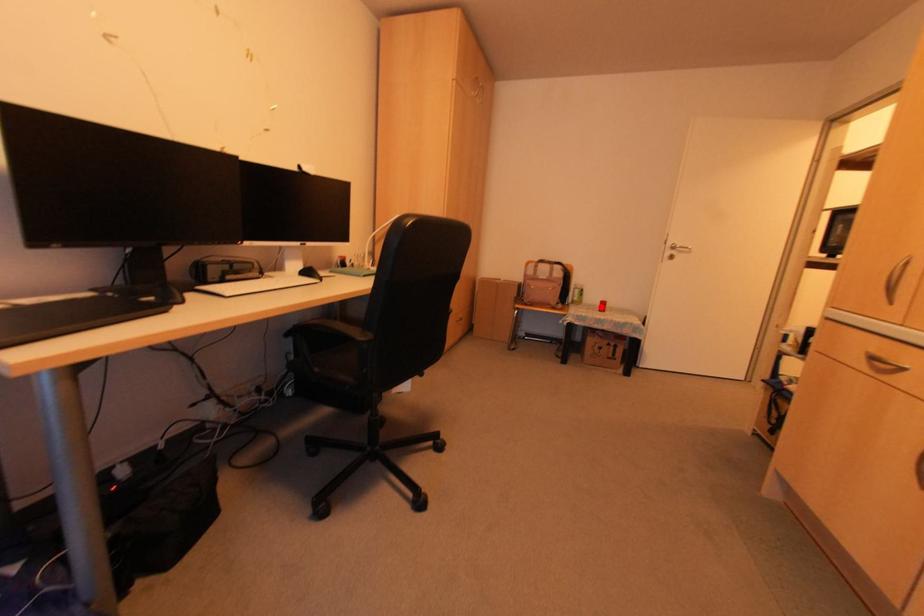
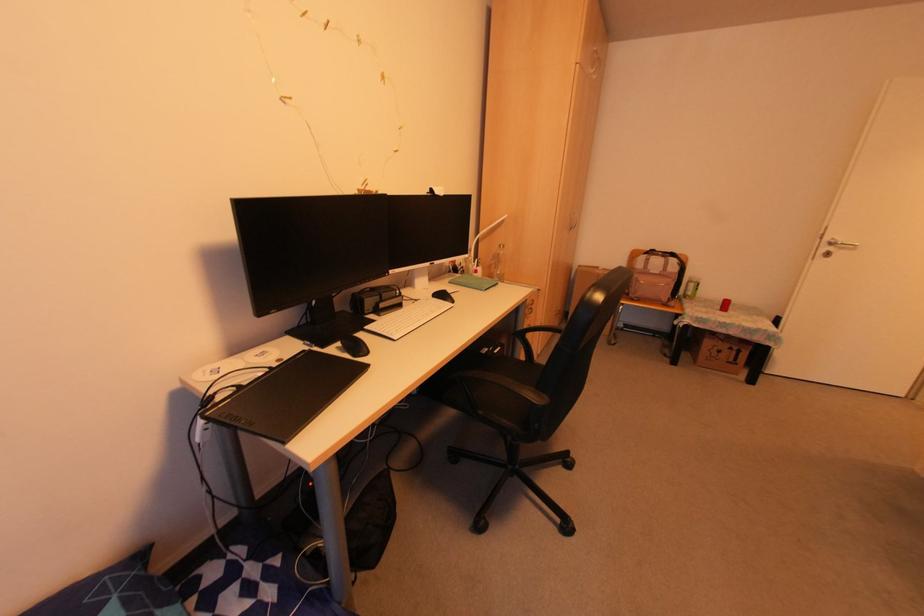
In the second image, find the point that corresponds to the highlighted location in the first image.

(723, 306)